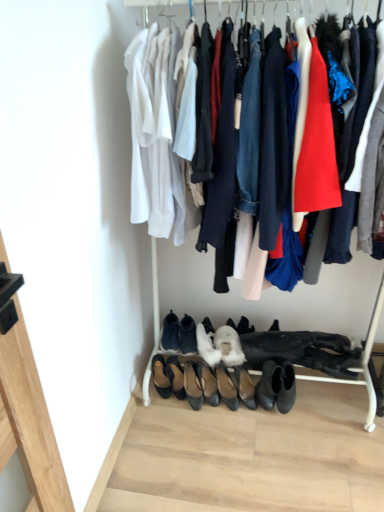
The image size is (384, 512). What do you see at coordinates (187, 335) in the screenshot? I see `suede black shoes at center, arranged as the 6th footwear when viewed from the right` at bounding box center [187, 335].

In order to face white suede heels at center, acting as the sixth footwear starting from the left, should I rotate leftwards or rightwards?

A 2.280 degree turn to the right will do.

Describe the element at coordinates (207, 347) in the screenshot. I see `white fluffy boot at center, the third footwear when ordered from right to left` at that location.

The image size is (384, 512). What do you see at coordinates (192, 385) in the screenshot?
I see `black leather flats at center, positioned as the 5th footwear in left-to-right order` at bounding box center [192, 385].

In order to face black leather shoes at lower center, the 9th footwear in the left-to-right sequence, should I rotate leftwards or rightwards?

You should rotate right by 7.633 degrees.

The height and width of the screenshot is (512, 384). I want to click on black leather shoes at lower center, the seventh footwear viewed from the right, so click(176, 376).

Who is taller, white fluffy boot at center, the third footwear when ordered from right to left, or suede black shoes at center, arranged as the 6th footwear when viewed from the right?

white fluffy boot at center, the third footwear when ordered from right to left, is taller.

From the picture: Is white fluffy boot at center, the third footwear when ordered from right to left, looking in the opposite direction of suede black shoes at center, arranged as the 4th footwear when viewed from the left?

No, suede black shoes at center, arranged as the 4th footwear when viewed from the left, is not at the back of white fluffy boot at center, the third footwear when ordered from right to left.

Considering the positions of point (207, 343) and point (187, 348), is point (207, 343) closer or farther from the camera than point (187, 348)?

Point (207, 343).

Image resolution: width=384 pixels, height=512 pixels. I want to click on the 7th footwear positioned below the leather black shoes at center, the 8th footwear when ordered from right to left (from the image's perspective), so click(x=192, y=385).

Which is more to the right, black leather flats at center, the 5th footwear in the right-to-left sequence, or leather black shoes at center, acting as the second footwear starting from the left?

Positioned to the right is black leather flats at center, the 5th footwear in the right-to-left sequence.

Is black leather flats at center, the 5th footwear in the right-to-left sequence, next to leather black shoes at center, the 8th footwear when ordered from right to left?

They are not placed beside each other.

Is black leather flats at center, positioned as the 5th footwear in left-to-right order, turned away from leather black shoes at center, acting as the second footwear starting from the left?

No, black leather flats at center, positioned as the 5th footwear in left-to-right order, is not facing away from leather black shoes at center, acting as the second footwear starting from the left.

Are white fluffy boot at center, the third footwear when ordered from right to left, and black leather shoes at lower center, the 9th footwear in the left-to-right sequence, beside each other?

No, white fluffy boot at center, the third footwear when ordered from right to left, is not touching black leather shoes at lower center, the 9th footwear in the left-to-right sequence.

Is black leather shoes at lower center, the 9th footwear in the left-to-right sequence, surrounded by white fluffy boot at center, the third footwear when ordered from right to left?

No.

Could you measure the distance between white fluffy boot at center, the third footwear when ordered from right to left, and black leather shoes at lower center, the 9th footwear in the left-to-right sequence?

The distance of white fluffy boot at center, the third footwear when ordered from right to left, from black leather shoes at lower center, the 9th footwear in the left-to-right sequence, is 16.80 centimeters.

From the picture: From the image's perspective, between white fluffy boot at center, the third footwear when ordered from right to left, and black leather shoes at lower center, the 9th footwear in the left-to-right sequence, who is located below?

black leather shoes at lower center, the 9th footwear in the left-to-right sequence, from the image's perspective.

Which of these two, white suede heels at center, acting as the sixth footwear starting from the left, or leather black shoes at center, acting as the second footwear starting from the left, is wider?

Wider between the two is leather black shoes at center, acting as the second footwear starting from the left.

Considering the relative sizes of white suede heels at center, acting as the sixth footwear starting from the left, and leather black shoes at center, acting as the second footwear starting from the left, in the image provided, is white suede heels at center, acting as the sixth footwear starting from the left, taller than leather black shoes at center, acting as the second footwear starting from the left,?

Yes.

Is leather black shoes at center, the 8th footwear when ordered from right to left, at the back of white suede heels at center, arranged as the 4th footwear when viewed from the right?

No, white suede heels at center, arranged as the 4th footwear when viewed from the right,'s orientation is not away from leather black shoes at center, the 8th footwear when ordered from right to left.

Are white suede heels at center, acting as the sixth footwear starting from the left, and leather black shoes at center, the 8th footwear when ordered from right to left, making contact?

They are not placed beside each other.

Considering the relative sizes of leather black shoes at center, acting as the second footwear starting from the left, and white fluffy boot at center, which is the second footwear from right to left, in the image provided, is leather black shoes at center, acting as the second footwear starting from the left, bigger than white fluffy boot at center, which is the second footwear from right to left,?

Correct, leather black shoes at center, acting as the second footwear starting from the left, is larger in size than white fluffy boot at center, which is the second footwear from right to left.

Can white fluffy boot at center, which is the second footwear from right to left, be found inside leather black shoes at center, the 8th footwear when ordered from right to left?

Definitely not — white fluffy boot at center, which is the second footwear from right to left, is not inside leather black shoes at center, the 8th footwear when ordered from right to left.

Is point (178, 350) positioned in front of point (229, 390)?

No, it is behind (229, 390).

From the image's perspective, which one is positioned higher, leather black shoes at center, acting as the second footwear starting from the left, or white fluffy boot at center, the 8th footwear in the left-to-right sequence?

leather black shoes at center, acting as the second footwear starting from the left, from the image's perspective.

Looking at this image, would you consider white suede heels at center, acting as the sixth footwear starting from the left, to be distant from black leather shoes at lower center, the first footwear from the right?

No.

From a real-world perspective, is white suede heels at center, acting as the sixth footwear starting from the left, physically above black leather shoes at lower center, the first footwear from the right?

Yes, from a real-world perspective, white suede heels at center, acting as the sixth footwear starting from the left, is on top of black leather shoes at lower center, the first footwear from the right.

Between white suede heels at center, arranged as the 4th footwear when viewed from the right, and black leather shoes at lower center, the first footwear from the right, which one has smaller size?

black leather shoes at lower center, the first footwear from the right, is smaller.

Identify the location of the 7th footwear in front of the suede black shoes at center, arranged as the 6th footwear when viewed from the right, starting your count from the anchor. This screenshot has width=384, height=512. (245, 387).

From the image's perspective, who appears lower, suede black shoes at center, arranged as the 6th footwear when viewed from the right, or black leather shoes at lower center, the first footwear from the right?

From the image's view, black leather shoes at lower center, the first footwear from the right, is below.

Is there a large distance between suede black shoes at center, arranged as the 6th footwear when viewed from the right, and black leather shoes at lower center, the 9th footwear in the left-to-right sequence?

suede black shoes at center, arranged as the 6th footwear when viewed from the right, is actually quite close to black leather shoes at lower center, the 9th footwear in the left-to-right sequence.

Does suede black shoes at center, arranged as the 4th footwear when viewed from the left, turn towards black leather shoes at lower center, the first footwear from the right?

No.

This screenshot has height=512, width=384. What are the coordinates of `the 2nd footwear in front of the suede black shoes at center, arranged as the 6th footwear when viewed from the right, starting your count from the anchor` in the screenshot? It's located at (207, 347).

What are the coordinates of `the 7th footwear below the leather black shoes at center, acting as the second footwear starting from the left (from a real-world perspective)` in the screenshot? It's located at (192, 385).

Based on their spatial positions, is white fluffy boot at center, the third footwear when ordered from right to left, or white fluffy boot at center, which is the second footwear from right to left, further from suede black shoes at center, arranged as the 6th footwear when viewed from the right?

Among the two, white fluffy boot at center, which is the second footwear from right to left, is located further to suede black shoes at center, arranged as the 6th footwear when viewed from the right.

Based on their spatial positions, is white fluffy boot at center, the third footwear when ordered from right to left, or leather black shoes at center, acting as the second footwear starting from the left, closer to black leather shoes at lower center, the first footwear from the right?

Among the two, white fluffy boot at center, the third footwear when ordered from right to left, is located nearer to black leather shoes at lower center, the first footwear from the right.

Considering their positions, is white suede heels at center, acting as the sixth footwear starting from the left, positioned closer to black leather flats at center, the 5th footwear in the right-to-left sequence, than black leather shoes at lower center, the 9th footwear in the left-to-right sequence?

The object closer to black leather flats at center, the 5th footwear in the right-to-left sequence, is white suede heels at center, acting as the sixth footwear starting from the left.

From the image, which object appears to be farther from leather black shoes at center, the 8th footwear when ordered from right to left, white fluffy boot at center, the 8th footwear in the left-to-right sequence, or white fluffy boot at center, the 7th footwear positioned from the left?

The object further to leather black shoes at center, the 8th footwear when ordered from right to left, is white fluffy boot at center, the 8th footwear in the left-to-right sequence.

When comparing their distances from white suede heels at center, arranged as the 4th footwear when viewed from the right, does suede black shoes at center, arranged as the 4th footwear when viewed from the left, or black leather flats at center, the 5th footwear in the right-to-left sequence, seem closer?

black leather flats at center, the 5th footwear in the right-to-left sequence, lies closer to white suede heels at center, arranged as the 4th footwear when viewed from the right, than the other object.

From the image, which object appears to be farther from white suede heels at center, arranged as the 4th footwear when viewed from the right, black leather shoes at lower center, positioned as the 3th footwear in left-to-right order, or white fluffy boot at center, the 7th footwear positioned from the left?

black leather shoes at lower center, positioned as the 3th footwear in left-to-right order, lies further to white suede heels at center, arranged as the 4th footwear when viewed from the right, than the other object.

Based on their spatial positions, is white fluffy boot at center, which is the second footwear from right to left, or suede black shoes at center, arranged as the 4th footwear when viewed from the left, closer to brown leather shoe at lower left, the first footwear from the left?

suede black shoes at center, arranged as the 4th footwear when viewed from the left, is positioned closer to the anchor brown leather shoe at lower left, the first footwear from the left.

Based on their spatial positions, is brown leather shoe at lower left, the first footwear from the left, or leather black shoes at center, the 8th footwear when ordered from right to left, closer to suede black shoes at center, arranged as the 6th footwear when viewed from the right?

The object closer to suede black shoes at center, arranged as the 6th footwear when viewed from the right, is leather black shoes at center, the 8th footwear when ordered from right to left.